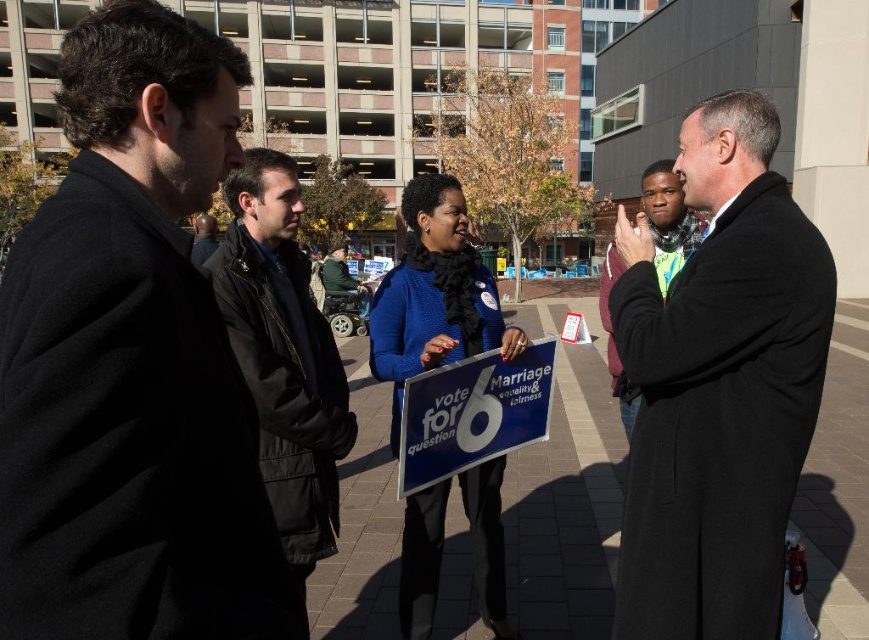
Based on the photo, you are a photographer trying to capture the woman holding the blue plastic sign at center and the person wearing the dark gray wool coat at right in the same frame. Given the size difference between the two objects, which object should you move closer to in order to make them appear similar in size in your photo?

The blue plastic sign at center is smaller than the dark gray wool coat at right. To make them appear similar in size in the photo, you should move closer to the blue plastic sign at center while keeping both objects in frame.

Consider the image. You are organizing a protest march and need to ensure that participants can walk side by side between the black puffy jacket at center and the green fabric wheelchair at center. How many people can walk side by side in this space?

The black puffy jacket at center occupies less space than the green fabric wheelchair at center. Therefore, the space between them can accommodate approximately 2 people walking side by side, depending on their shoulder width.